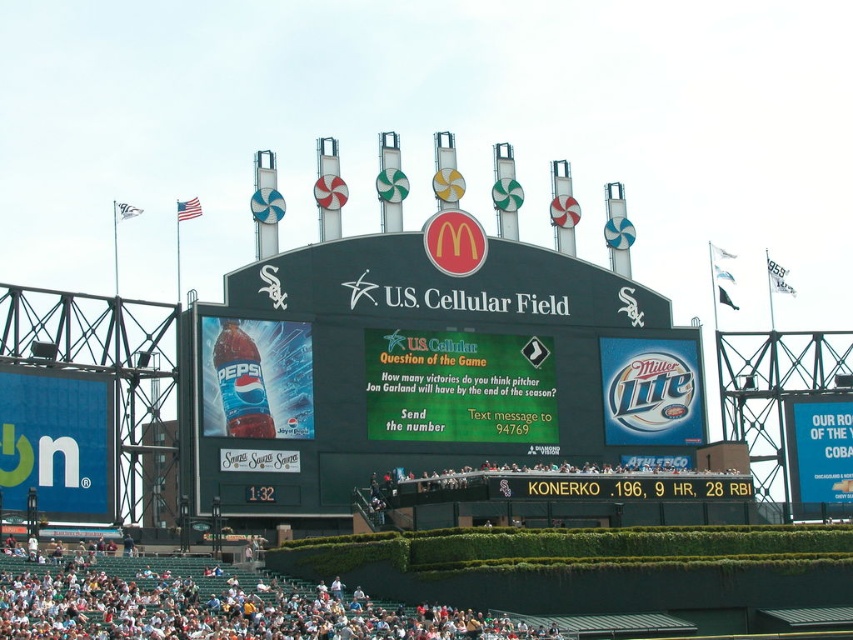
Question: Can you confirm if black matte scoreboard at center is positioned to the left of white plastic seats at lower center?

Choices:
 (A) no
 (B) yes

Answer: (A)

Question: Is black matte scoreboard at center above white plastic seats at lower center?

Choices:
 (A) yes
 (B) no

Answer: (A)

Question: Does black matte scoreboard at center have a greater width compared to white plastic seats at lower center?

Choices:
 (A) yes
 (B) no

Answer: (A)